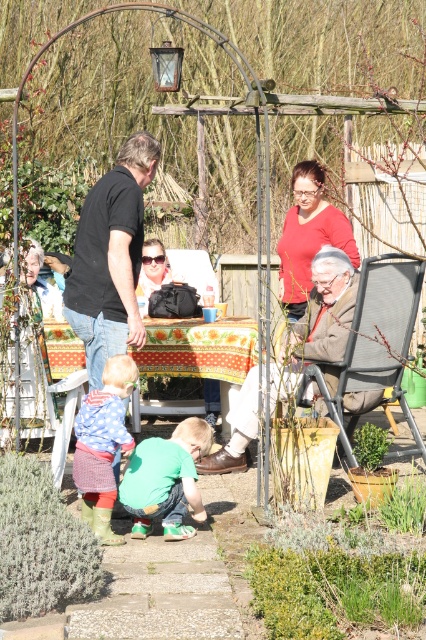
Is point (298, 586) positioned behind point (74, 593)?

No, it is not.

Does point (322, 624) lie behind point (20, 600)?

That is False.

Locate an element on the screen. The height and width of the screenshot is (640, 426). green leafy plant at lower center is located at coordinates (331, 580).

Does green leafy plant at lower center lie behind floral tablecloth at center?

No, it is in front of floral tablecloth at center.

Does point (313, 608) come closer to viewer compared to point (196, 355)?

That is True.

Image resolution: width=426 pixels, height=640 pixels. What are the coordinates of `green leafy plant at lower center` in the screenshot? It's located at (331, 580).

Is floral tablecloth at center to the right of matte red shirt at upper center from the viewer's perspective?

In fact, floral tablecloth at center is to the left of matte red shirt at upper center.

Is floral tablecloth at center to the left of matte red shirt at upper center from the viewer's perspective?

Yes, floral tablecloth at center is to the left of matte red shirt at upper center.

Who is more distant from viewer, (60,346) or (330,230)?

The point (330,230) is behind.

The width and height of the screenshot is (426, 640). Identify the location of floral tablecloth at center. (201, 352).